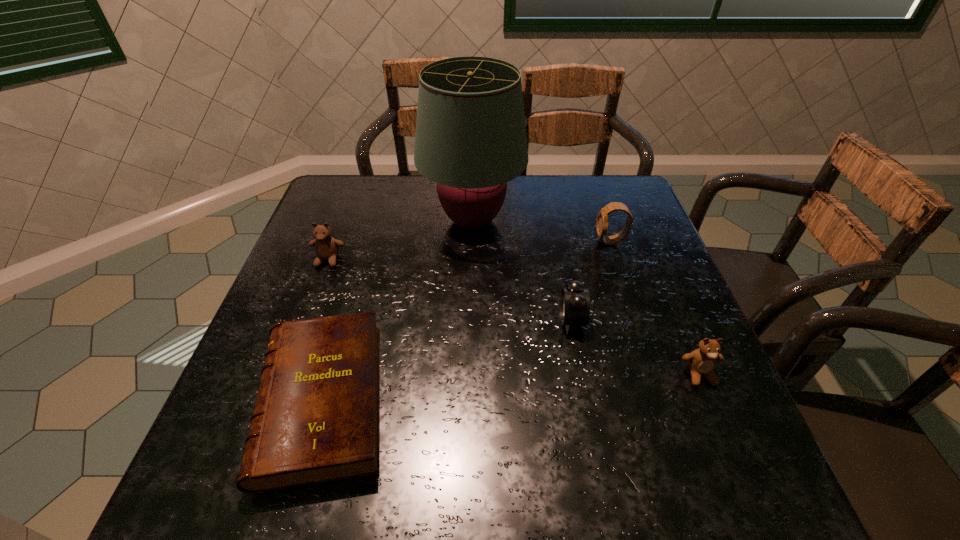
In order to click on lampshade in this screenshot , I will do `click(470, 139)`.

The width and height of the screenshot is (960, 540). What are the coordinates of `the third object from left to right` in the screenshot? It's located at (470, 139).

At what (x,y) coordinates should I click in order to perform the action: click on the fifth object from left to right. Please return your answer as a coordinate pair (x, y). The image size is (960, 540). Looking at the image, I should click on (602, 222).

Locate an element on the screen. This screenshot has height=540, width=960. the left teddy bear is located at coordinates click(327, 247).

The image size is (960, 540). What are the coordinates of `alarm clock` in the screenshot? It's located at (574, 308).

At what (x,y) coordinates should I click in order to perform the action: click on the nearer teddy bear. Please return your answer as a coordinate pair (x, y). This screenshot has height=540, width=960. Looking at the image, I should click on (701, 362).

Locate an element on the screen. The height and width of the screenshot is (540, 960). the right teddy bear is located at coordinates (701, 362).

The image size is (960, 540). I want to click on hardback book, so click(316, 417).

Find the location of `vacant position located 0.250m on the right of the tallest object`. vacant position located 0.250m on the right of the tallest object is located at coordinates (612, 221).

This screenshot has height=540, width=960. In order to click on free space located 0.060m on the face of the watch in this screenshot , I will do `click(573, 241)`.